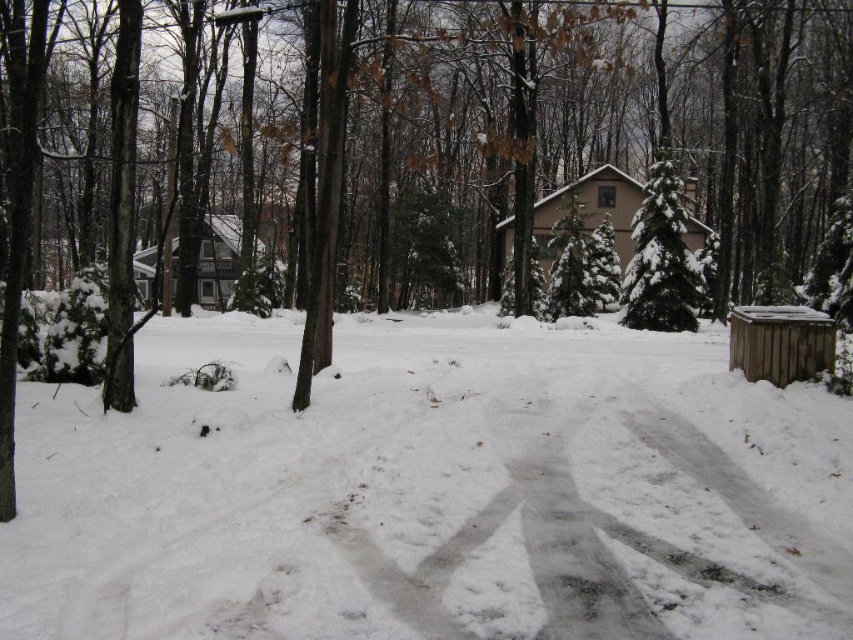
Question: Estimate the real-world distances between objects in this image. Which object is closer to the brown wooden shed at right?

Choices:
 (A) white fluffy snow at center
 (B) green textured evergreen at center

Answer: (A)

Question: Which object is positioned farthest from the brown wooden shed at right?

Choices:
 (A) green textured evergreen at center
 (B) white fluffy snow at center

Answer: (A)

Question: Observing the image, what is the correct spatial positioning of white fluffy snow at center in reference to brown wooden shed at right?

Choices:
 (A) above
 (B) below

Answer: (B)

Question: Observing the image, what is the correct spatial positioning of white fluffy snow at center in reference to green textured evergreen at center?

Choices:
 (A) left
 (B) right

Answer: (A)

Question: Which of these objects is positioned closest to the green textured evergreen at center?

Choices:
 (A) brown wooden shed at right
 (B) white fluffy snow at center

Answer: (A)

Question: Does white fluffy snow at center have a lesser width compared to brown wooden shed at right?

Choices:
 (A) no
 (B) yes

Answer: (A)